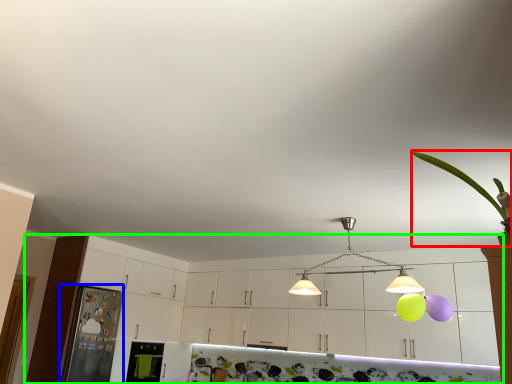
Question: Which object is the closest to the plant (highlighted by a red box)? Choose among these: appliance (highlighted by a blue box) or cabinetry (highlighted by a green box).

Choices:
 (A) appliance
 (B) cabinetry

Answer: (B)